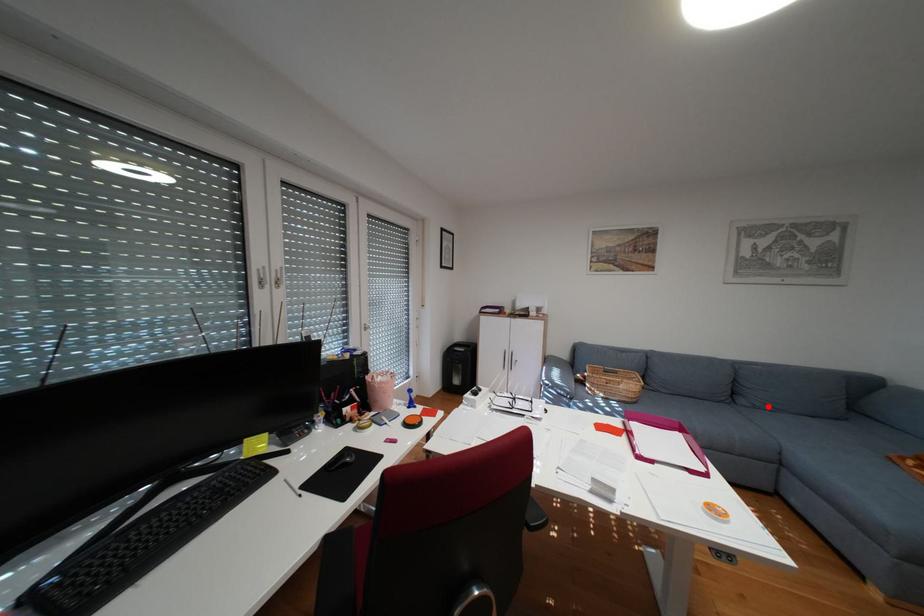
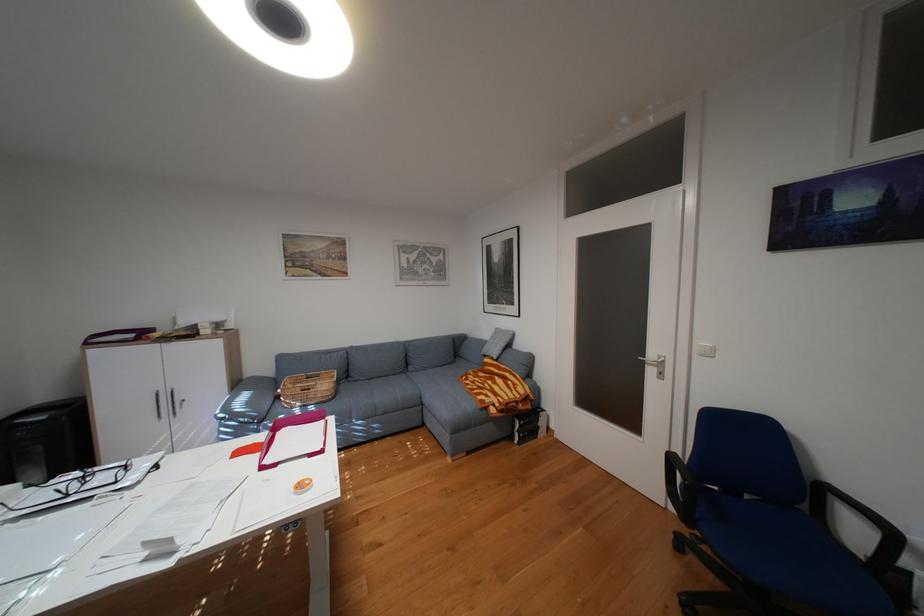
The point at the highlighted location is marked in the first image. Where is the corresponding point in the second image?

(430, 370)